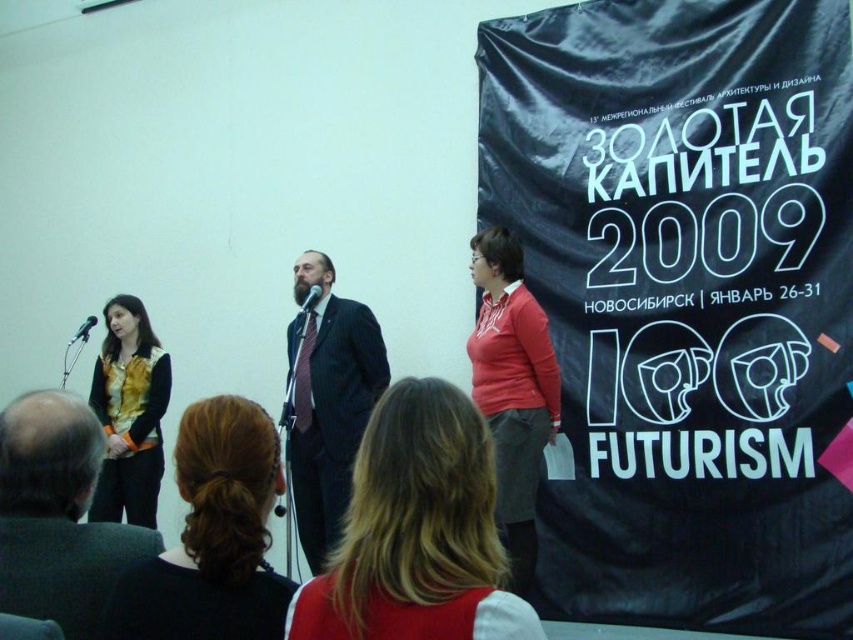
Question: Which point is closer to the camera?

Choices:
 (A) (782, 624)
 (B) (78, 412)

Answer: (B)

Question: Which object is positioned closest to the matte yellow vest at left?

Choices:
 (A) black fabric banner at right
 (B) matte red sweater at center

Answer: (B)

Question: Is blonde hair at center to the right of dark pinstripe suit at center from the viewer's perspective?

Choices:
 (A) yes
 (B) no

Answer: (A)

Question: Which point is closer to the camera taking this photo?

Choices:
 (A) (74, 336)
 (B) (283, 580)
 (C) (16, 481)

Answer: (B)

Question: Is matte black suit at center smaller than matte yellow vest at left?

Choices:
 (A) no
 (B) yes

Answer: (B)

Question: Does blonde hair at center have a greater width compared to matte black suit at center?

Choices:
 (A) no
 (B) yes

Answer: (B)